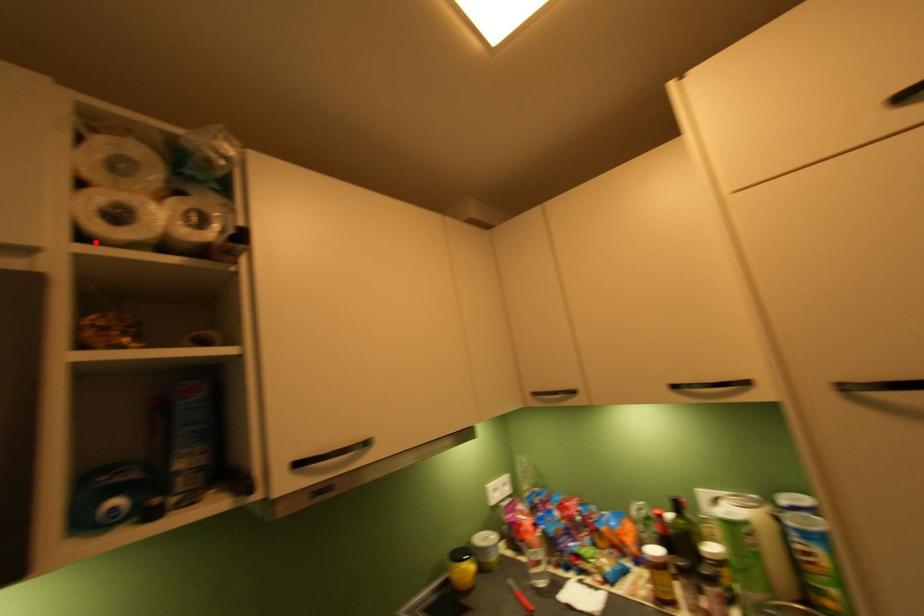
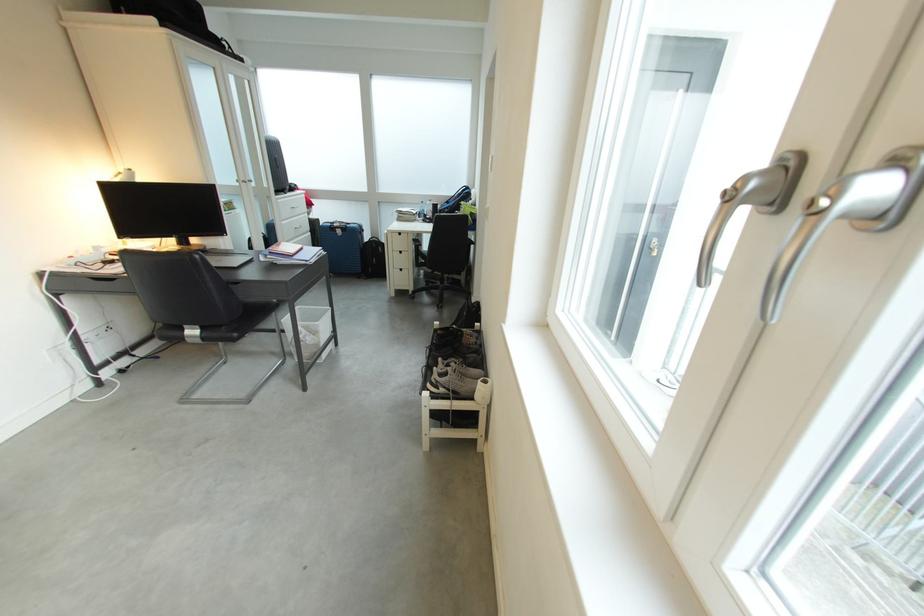
Question: I am providing you with two images of the same scene from different viewpoints. A red point is marked on the first image. Is the red point's position out of view in image 2?

Choices:
 (A) Yes
 (B) No

Answer: (A)